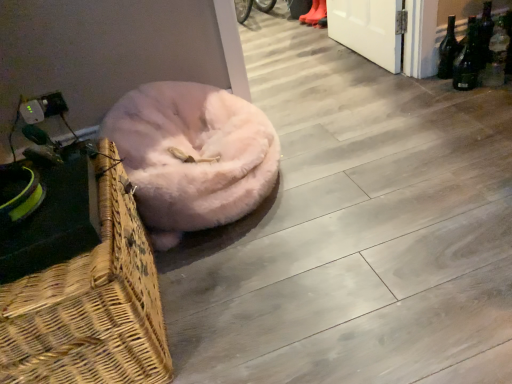
At what (x,y) coordinates should I click in order to perform the action: click on vacant area that is in front of fuzzy pink dog bed at lower left. Please return your answer as a coordinate pair (x, y). This screenshot has width=512, height=384. Looking at the image, I should click on (283, 284).